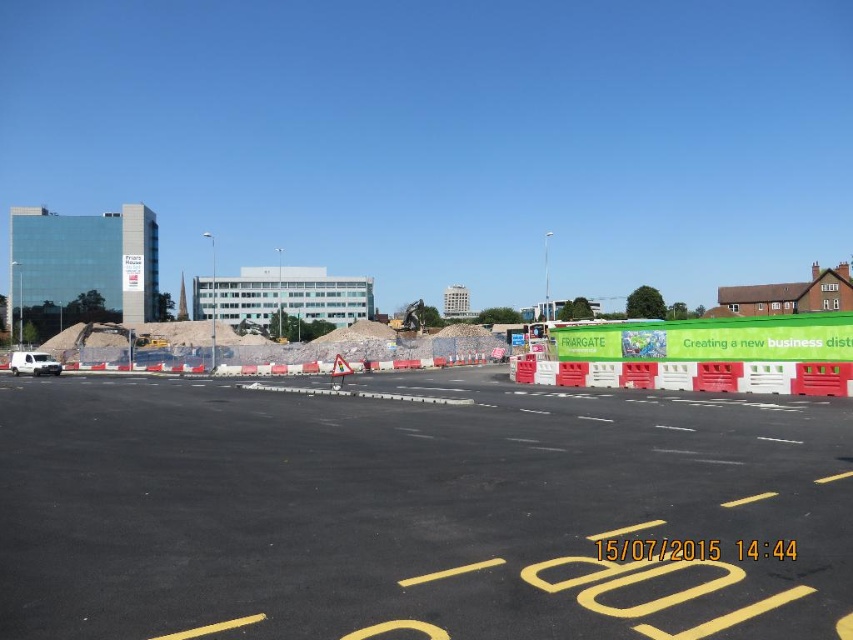
Does white/red plastic barrier at center have a greater height compared to white matte van at lower left?

Correct, white/red plastic barrier at center is much taller as white matte van at lower left.

Does white/red plastic barrier at center appear on the right side of white matte van at lower left?

Indeed, white/red plastic barrier at center is positioned on the right side of white matte van at lower left.

The width and height of the screenshot is (853, 640). What do you see at coordinates (689, 376) in the screenshot?
I see `white/red plastic barrier at center` at bounding box center [689, 376].

I want to click on white/red plastic barrier at center, so click(689, 376).

Is black asphalt parking lot at center smaller than white matte van at lower left?

No, black asphalt parking lot at center is not smaller than white matte van at lower left.

Between black asphalt parking lot at center and white matte van at lower left, which one has less height?

white matte van at lower left

This screenshot has width=853, height=640. In order to click on black asphalt parking lot at center in this screenshot , I will do `click(410, 509)`.

You are a GUI agent. You are given a task and a screenshot of the screen. Output one action in this format:
    pyautogui.click(x=<x>, y=<y>)
    Task: Click on the black asphalt parking lot at center
    The height and width of the screenshot is (640, 853).
    Given the screenshot: What is the action you would take?
    pyautogui.click(x=410, y=509)

Is point (0, 422) closer to viewer compared to point (537, 368)?

Yes, it is in front of point (537, 368).

Between point (154, 474) and point (737, 362), which one is positioned behind?

Point (737, 362)

Where is `black asphalt parking lot at center`? The height and width of the screenshot is (640, 853). black asphalt parking lot at center is located at coordinates click(410, 509).